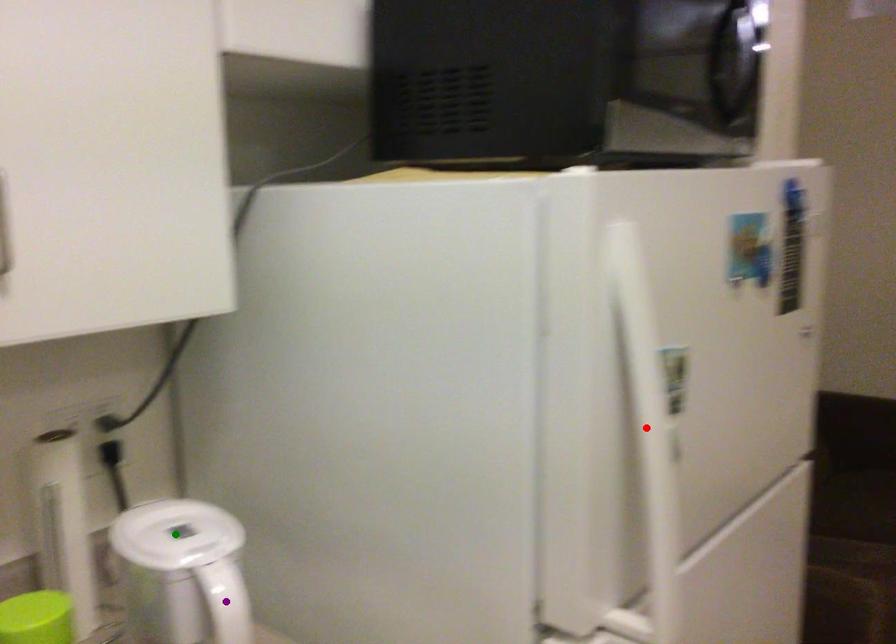
Looking at this image, order these from nearest to farthest:
1. purple point
2. red point
3. green point

1. purple point
2. red point
3. green point